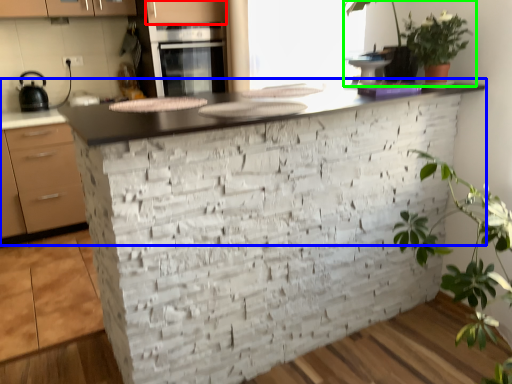
Question: Which object is positioned farthest from cabinetry (highlighted by a red box)? Select from countertop (highlighted by a blue box) and houseplant (highlighted by a green box).

Choices:
 (A) countertop
 (B) houseplant

Answer: (B)